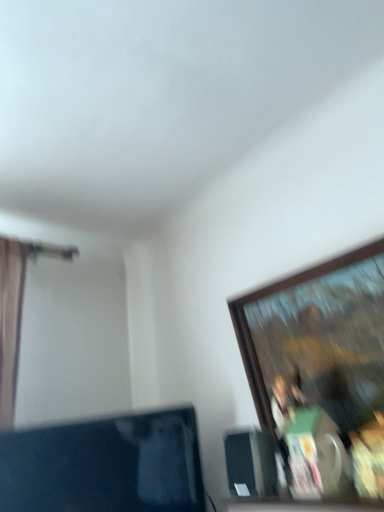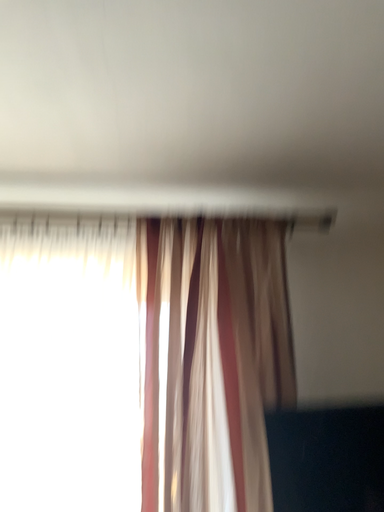
Question: How did the camera likely rotate when shooting the video?

Choices:
 (A) rotated right
 (B) rotated left

Answer: (B)